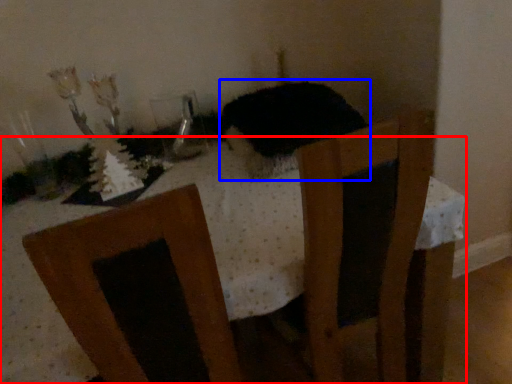
Question: Which object is further to the camera taking this photo, table (highlighted by a red box) or animal (highlighted by a blue box)?

Choices:
 (A) table
 (B) animal

Answer: (B)